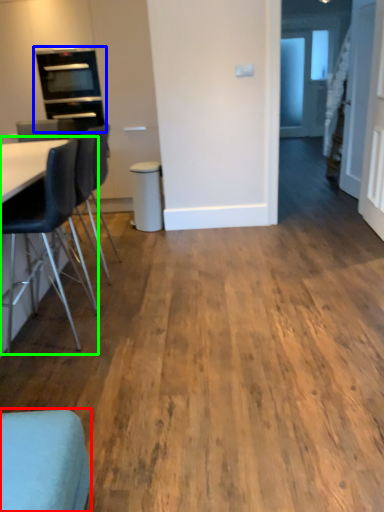
Question: Estimate the real-world distances between objects in this image. Which object is farther from chair (highlighted by a red box), appliance (highlighted by a blue box) or chair (highlighted by a green box)?

Choices:
 (A) appliance
 (B) chair

Answer: (A)